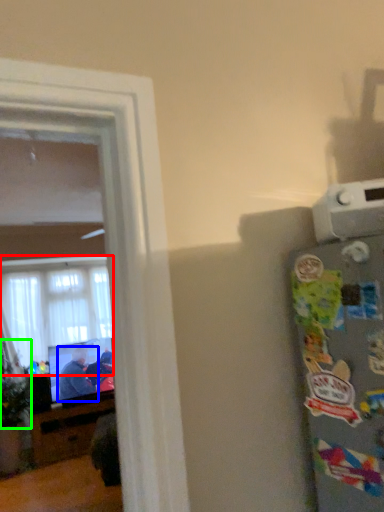
Question: Estimate the real-world distances between objects in this image. Which object is closer to window (highlighted by a red box), person (highlighted by a blue box) or plant (highlighted by a green box)?

Choices:
 (A) person
 (B) plant

Answer: (B)